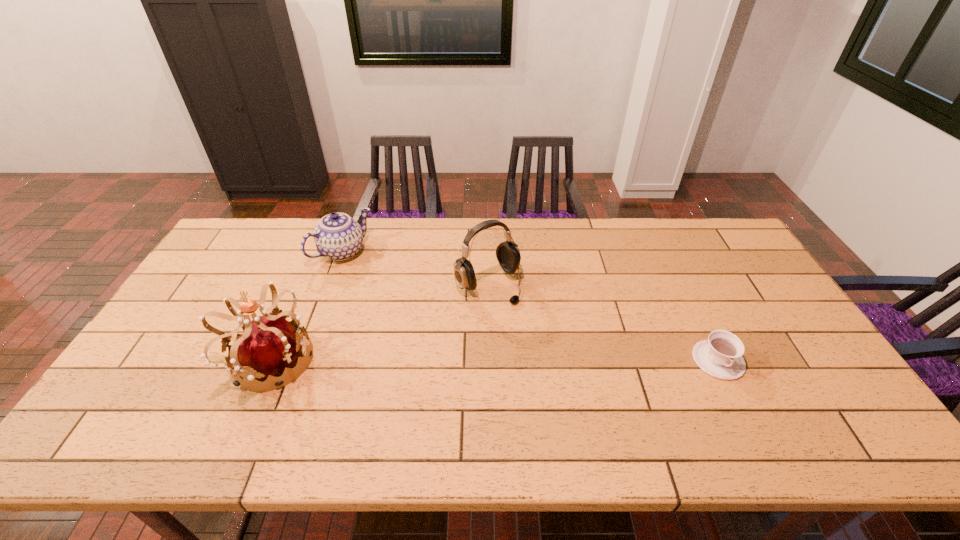
Locate an element on the screen. free spot on the desktop that is between the tiara and the rightmost object and is positioned with the microphone on the side of the headset is located at coordinates (556, 360).

Where is `vacant space on the desktop that is between the tiara and the shortest object and is positioned at the spout of the chinaware`? vacant space on the desktop that is between the tiara and the shortest object and is positioned at the spout of the chinaware is located at coordinates (462, 360).